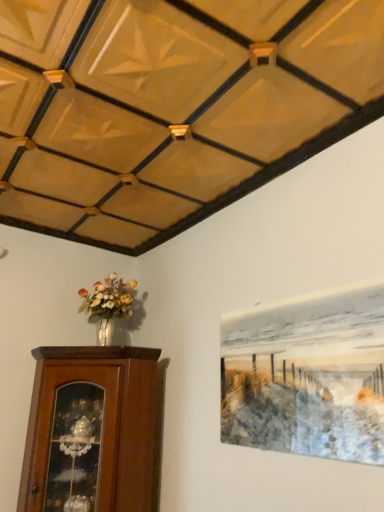
This screenshot has width=384, height=512. Describe the element at coordinates (90, 430) in the screenshot. I see `brown wooden cabinet at lower left` at that location.

Image resolution: width=384 pixels, height=512 pixels. What are the coordinates of `brown wooden cabinet at lower left` in the screenshot? It's located at (90, 430).

The image size is (384, 512). I want to click on metallic silver painting at upper right, so click(307, 375).

What do you see at coordinates (307, 375) in the screenshot? The width and height of the screenshot is (384, 512). I see `metallic silver painting at upper right` at bounding box center [307, 375].

Locate an element on the screen. The width and height of the screenshot is (384, 512). brown wooden cabinet at lower left is located at coordinates (90, 430).

Is brown wooden cabinet at lower left to the right of metallic silver painting at upper right from the viewer's perspective?

Incorrect, brown wooden cabinet at lower left is not on the right side of metallic silver painting at upper right.

Which object is more forward, brown wooden cabinet at lower left or metallic silver painting at upper right?

metallic silver painting at upper right is more forward.

Which is in front, point (90, 354) or point (367, 357)?

Point (367, 357)

From the image's perspective, is brown wooden cabinet at lower left located above or below metallic silver painting at upper right?

From the image's perspective, brown wooden cabinet at lower left appears below metallic silver painting at upper right.

From a real-world perspective, between brown wooden cabinet at lower left and metallic silver painting at upper right, who is vertically lower?

In real-world perspective, brown wooden cabinet at lower left is lower.

Considering the sizes of objects brown wooden cabinet at lower left and metallic silver painting at upper right in the image provided, who is thinner, brown wooden cabinet at lower left or metallic silver painting at upper right?

With smaller width is metallic silver painting at upper right.

In terms of height, does brown wooden cabinet at lower left look taller or shorter compared to metallic silver painting at upper right?

Considering their sizes, brown wooden cabinet at lower left has more height than metallic silver painting at upper right.

Consider the image. Can you confirm if brown wooden cabinet at lower left is bigger than metallic silver painting at upper right?

Yes, brown wooden cabinet at lower left is bigger than metallic silver painting at upper right.

Is metallic silver painting at upper right a part of brown wooden cabinet at lower left?

No, metallic silver painting at upper right is located outside of brown wooden cabinet at lower left.

Is brown wooden cabinet at lower left in contact with metallic silver painting at upper right?

No, brown wooden cabinet at lower left is not making contact with metallic silver painting at upper right.

Is brown wooden cabinet at lower left facing away from metallic silver painting at upper right?

No, brown wooden cabinet at lower left's orientation is not away from metallic silver painting at upper right.

I want to click on picture frame to the right of brown wooden cabinet at lower left, so click(307, 375).

Considering the positions of objects metallic silver painting at upper right and brown wooden cabinet at lower left in the image provided, who is more to the left, metallic silver painting at upper right or brown wooden cabinet at lower left?

Positioned to the left is brown wooden cabinet at lower left.

Between metallic silver painting at upper right and brown wooden cabinet at lower left, which one is positioned in front?

Positioned in front is metallic silver painting at upper right.

Which point is more forward, (292, 352) or (121, 506)?

The point (292, 352) is in front.

From the image's perspective, is metallic silver painting at upper right beneath brown wooden cabinet at lower left?

Incorrect, from the image's perspective, metallic silver painting at upper right is higher than brown wooden cabinet at lower left.

From a real-world perspective, which is physically above, metallic silver painting at upper right or brown wooden cabinet at lower left?

metallic silver painting at upper right, from a real-world perspective.

Is metallic silver painting at upper right thinner than brown wooden cabinet at lower left?

Yes, metallic silver painting at upper right is thinner than brown wooden cabinet at lower left.

Can you confirm if metallic silver painting at upper right is taller than brown wooden cabinet at lower left?

No.

Who is bigger, metallic silver painting at upper right or brown wooden cabinet at lower left?

brown wooden cabinet at lower left.

Is metallic silver painting at upper right inside the boundaries of brown wooden cabinet at lower left, or outside?

metallic silver painting at upper right is not enclosed by brown wooden cabinet at lower left.

Are metallic silver painting at upper right and brown wooden cabinet at lower left making contact?

metallic silver painting at upper right is not next to brown wooden cabinet at lower left, and they're not touching.

Is metallic silver painting at upper right turned away from brown wooden cabinet at lower left?

No.

How different are the orientations of metallic silver painting at upper right and brown wooden cabinet at lower left in degrees?

There is a 42.5-degree angle between the facing directions of metallic silver painting at upper right and brown wooden cabinet at lower left.

Identify the location of picture frame above the brown wooden cabinet at lower left (from a real-world perspective). The height and width of the screenshot is (512, 384). (307, 375).

The height and width of the screenshot is (512, 384). What are the coordinates of `furniture on the left of metallic silver painting at upper right` in the screenshot? It's located at (90, 430).

Find the location of a particular element. This screenshot has width=384, height=512. furniture that is below the metallic silver painting at upper right (from the image's perspective) is located at coordinates (90, 430).